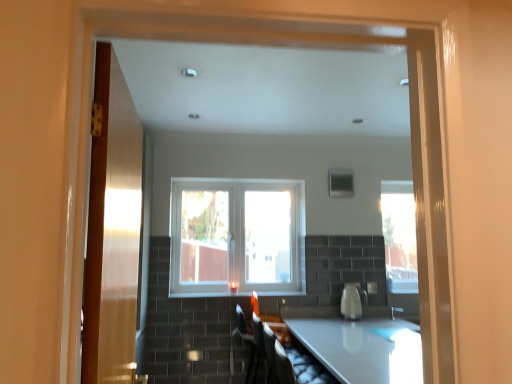
Question: Should I look upward or downward to see white glossy kettle at center?

Choices:
 (A) up
 (B) down

Answer: (B)

Question: Does white glossy kettle at center appear on the left side of white plastic window at center?

Choices:
 (A) yes
 (B) no

Answer: (B)

Question: Can you confirm if white glossy kettle at center is taller than white plastic window at center?

Choices:
 (A) no
 (B) yes

Answer: (A)

Question: Does white glossy kettle at center have a lesser height compared to white plastic window at center?

Choices:
 (A) yes
 (B) no

Answer: (A)

Question: Could you tell me if white glossy kettle at center is facing white plastic window at center?

Choices:
 (A) yes
 (B) no

Answer: (B)

Question: Does white glossy kettle at center have a smaller size compared to white plastic window at center?

Choices:
 (A) yes
 (B) no

Answer: (A)

Question: From a real-world perspective, is white glossy kettle at center positioned over white plastic window at center based on gravity?

Choices:
 (A) no
 (B) yes

Answer: (A)

Question: Is wooden door at left to the left of matte black armchair at lower center, which appears as the 1th armchair when viewed from the back, from the viewer's perspective?

Choices:
 (A) yes
 (B) no

Answer: (A)

Question: From the image's perspective, does wooden door at left appear higher than matte black armchair at lower center, which appears as the 1th armchair when viewed from the back?

Choices:
 (A) no
 (B) yes

Answer: (B)

Question: Is wooden door at left oriented away from matte black armchair at lower center, which is the 2th armchair from front to back?

Choices:
 (A) yes
 (B) no

Answer: (B)

Question: Would you say wooden door at left is outside matte black armchair at lower center, which is the 2th armchair from front to back?

Choices:
 (A) no
 (B) yes

Answer: (B)

Question: Is wooden door at left positioned behind matte black armchair at lower center, which is the 2th armchair from front to back?

Choices:
 (A) no
 (B) yes

Answer: (A)

Question: From a real-world perspective, is wooden door at left under matte black armchair at lower center, which is the 2th armchair from front to back?

Choices:
 (A) no
 (B) yes

Answer: (A)

Question: Is white plastic window at center smaller than matte black armchair at lower center, which is the first armchair from front to back?

Choices:
 (A) yes
 (B) no

Answer: (B)